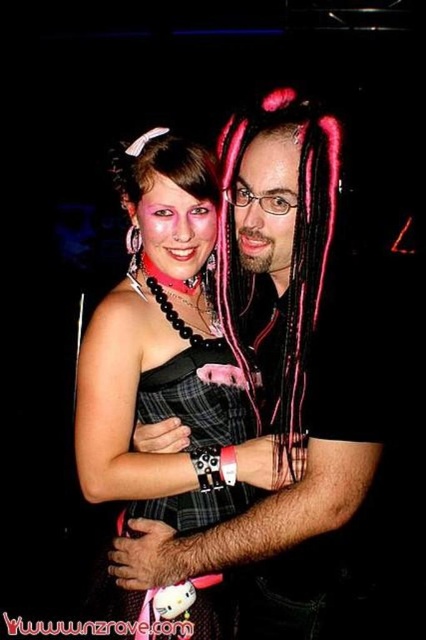
You are a photographer at a party and need to capture both the matte black dress at center and the pink braided hair at center in a single frame. Since the dress is wider than the hair, which object should you focus on to ensure both fit in the photo?

The matte black dress at center is wider than the pink braided hair at center. To ensure both fit in the photo, focus on the matte black dress at center as the wider object, and adjust the framing to include the pink braided hair at center within the same shot.

You are a photographer at a party who wants to take a portrait of the two people. You need to ensure that both the pink braided hair at center and the plaid fabric dress at center are clearly visible in the frame. Given that the camera has a fixed aperture setting, which object should you focus on to ensure both are in focus?

Since the pink braided hair at center is thinner than the plaid fabric dress at center, you should focus on the plaid fabric dress at center to ensure both are in focus. This is because focusing on the larger object allows for a deeper depth of field, capturing both objects clearly.